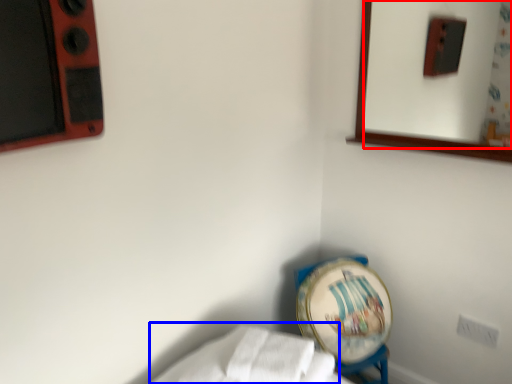
Question: Which of the following is the farthest to the observer, mirror (highlighted by a red box) or sheet (highlighted by a blue box)?

Choices:
 (A) mirror
 (B) sheet

Answer: (A)